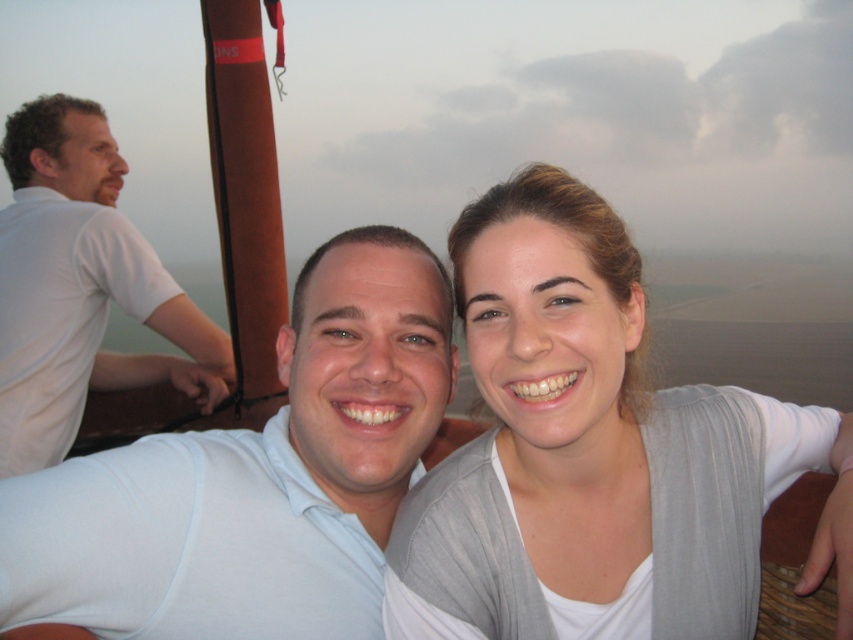
Question: Estimate the real-world distances between objects in this image. Which object is farther from the white cotton shirt at left?

Choices:
 (A) light gray knit cardigan at center
 (B) white matte shirt at center

Answer: (A)

Question: Which is farther from the white matte shirt at center?

Choices:
 (A) white cotton shirt at left
 (B) light gray knit cardigan at center

Answer: (A)

Question: Considering the relative positions of light gray knit cardigan at center and white matte shirt at center in the image provided, where is light gray knit cardigan at center located with respect to white matte shirt at center?

Choices:
 (A) above
 (B) below

Answer: (A)

Question: Is light gray knit cardigan at center to the left of white matte shirt at center from the viewer's perspective?

Choices:
 (A) no
 (B) yes

Answer: (A)

Question: Which of these objects is positioned closest to the light gray knit cardigan at center?

Choices:
 (A) white matte shirt at center
 (B) white cotton shirt at left

Answer: (A)

Question: Is light gray knit cardigan at center positioned before white cotton shirt at left?

Choices:
 (A) yes
 (B) no

Answer: (A)